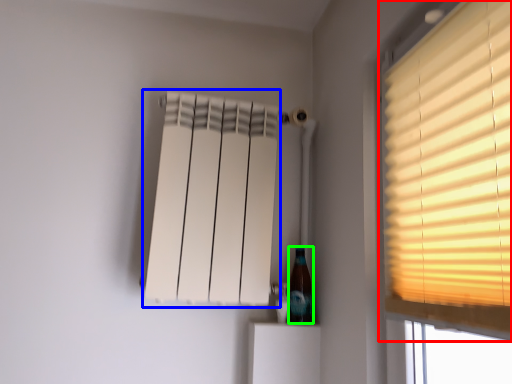
Question: Estimate the real-world distances between objects in this image. Which object is farther from window (highlighted by a red box), curtain (highlighted by a blue box) or bottle (highlighted by a green box)?

Choices:
 (A) curtain
 (B) bottle

Answer: (B)